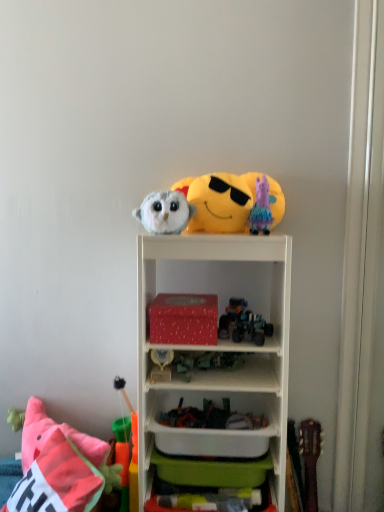
Question: Is fluffy pink pillow at lower left surrounded by shiny metallic car at center, which is the 4th toy from bottom to top?

Choices:
 (A) yes
 (B) no

Answer: (B)

Question: Considering the relative positions of shiny metallic car at center, the fifth toy when ordered from top to bottom, and fluffy pink pillow at lower left in the image provided, is shiny metallic car at center, the fifth toy when ordered from top to bottom, to the right of fluffy pink pillow at lower left from the viewer's perspective?

Choices:
 (A) no
 (B) yes

Answer: (B)

Question: Is shiny metallic car at center, the fifth toy when ordered from top to bottom, wider than fluffy pink pillow at lower left?

Choices:
 (A) yes
 (B) no

Answer: (B)

Question: Is shiny metallic car at center, the fifth toy when ordered from top to bottom, facing away from fluffy pink pillow at lower left?

Choices:
 (A) no
 (B) yes

Answer: (A)

Question: Can you confirm if shiny metallic car at center, the fifth toy when ordered from top to bottom, is thinner than fluffy pink pillow at lower left?

Choices:
 (A) no
 (B) yes

Answer: (B)

Question: In the image, is white plastic shelf at upper center on the left side or the right side of red matte box at center?

Choices:
 (A) left
 (B) right

Answer: (B)

Question: From the image's perspective, relative to red matte box at center, is white plastic shelf at upper center above or below?

Choices:
 (A) below
 (B) above

Answer: (A)

Question: Is white plastic shelf at upper center inside or outside of red matte box at center?

Choices:
 (A) outside
 (B) inside

Answer: (A)

Question: In the image, is white plastic shelf at upper center positioned in front of or behind red matte box at center?

Choices:
 (A) behind
 (B) front

Answer: (B)

Question: From their relative heights in the image, would you say green plastic cup at lower left, which ranks as the 1th toy in bottom-to-top order, is taller or shorter than shiny metallic robot at center, positioned as the 5th toy in bottom-to-top order?

Choices:
 (A) short
 (B) tall

Answer: (B)

Question: From the image's perspective, is green plastic cup at lower left, which ranks as the 1th toy in bottom-to-top order, located above or below shiny metallic robot at center, placed as the 4th toy when sorted from top to bottom?

Choices:
 (A) below
 (B) above

Answer: (A)

Question: Would you say green plastic cup at lower left, which appears as the eighth toy when viewed from the top, is to the left or to the right of shiny metallic robot at center, positioned as the 5th toy in bottom-to-top order, in the picture?

Choices:
 (A) right
 (B) left

Answer: (B)

Question: Choose the correct answer: Is green plastic cup at lower left, which appears as the eighth toy when viewed from the top, inside shiny metallic robot at center, placed as the 4th toy when sorted from top to bottom, or outside it?

Choices:
 (A) inside
 (B) outside

Answer: (B)

Question: From the image's perspective, relative to white plastic shelf at upper center, is red matte box at center above or below?

Choices:
 (A) below
 (B) above

Answer: (B)

Question: In terms of height, does red matte box at center look taller or shorter compared to white plastic shelf at upper center?

Choices:
 (A) tall
 (B) short

Answer: (B)